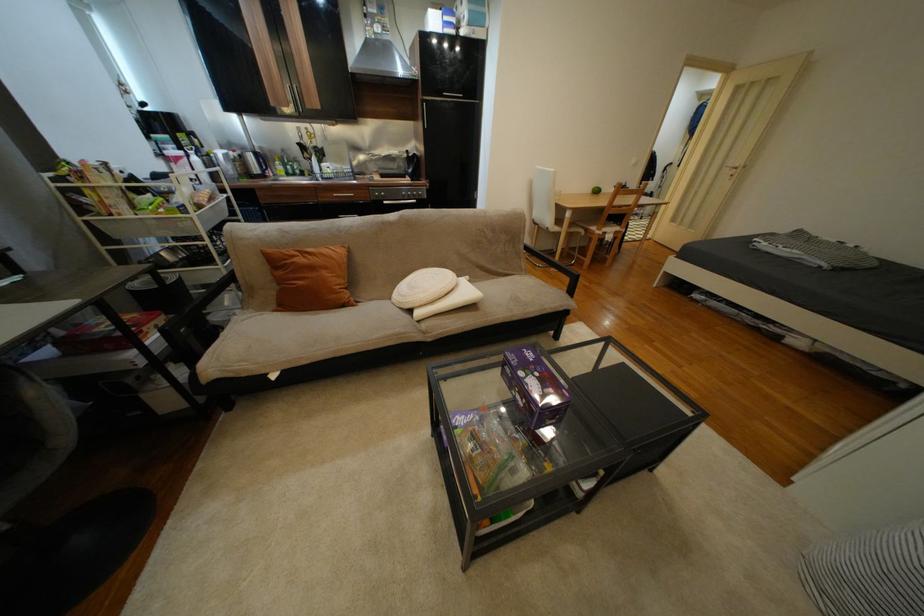
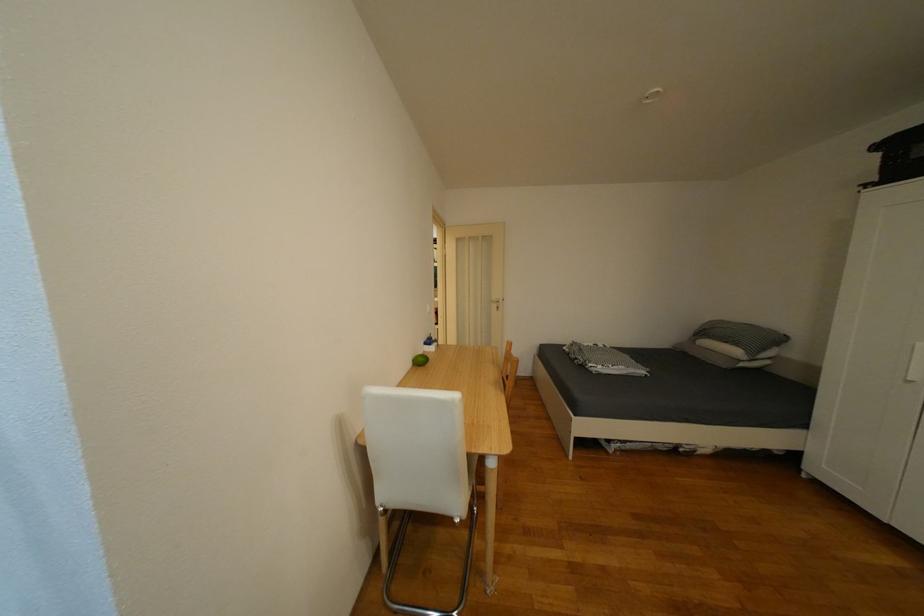
In the second image, find the point that corresponds to point 604,191 in the first image.

(431, 361)